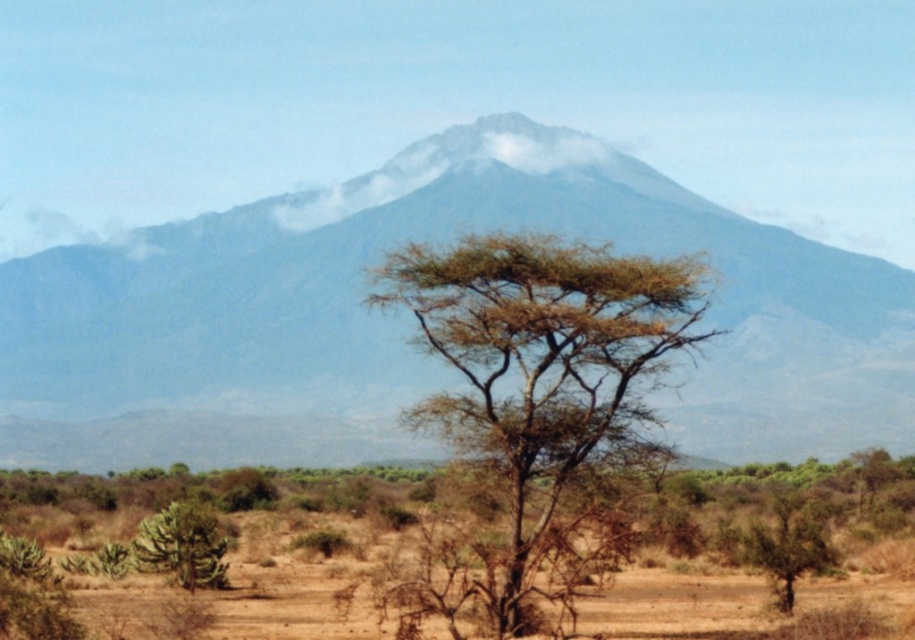
Question: Which object appears farthest from the camera in this image?

Choices:
 (A) green spiky bush at lower left
 (B) gray/dusty rock mountain at upper center
 (C) brown rough tree at center
 (D) brown leafy tree at center

Answer: (B)

Question: Estimate the real-world distances between objects in this image. Which object is closer to the brown leafy tree at center?

Choices:
 (A) green spiky bush at lower left
 (B) gray/dusty rock mountain at upper center

Answer: (A)

Question: Which is farther from the brown rough tree at center?

Choices:
 (A) brown dry soil at center
 (B) gray/dusty rock mountain at upper center
 (C) green spiky bush at lower left

Answer: (B)

Question: Does gray/dusty rock mountain at upper center come behind green spiky bush at lower left?

Choices:
 (A) no
 (B) yes

Answer: (B)

Question: Does gray/dusty rock mountain at upper center come in front of green spiky bush at lower left?

Choices:
 (A) yes
 (B) no

Answer: (B)

Question: Is brown dry soil at center thinner than green spiky bush at lower left?

Choices:
 (A) yes
 (B) no

Answer: (B)